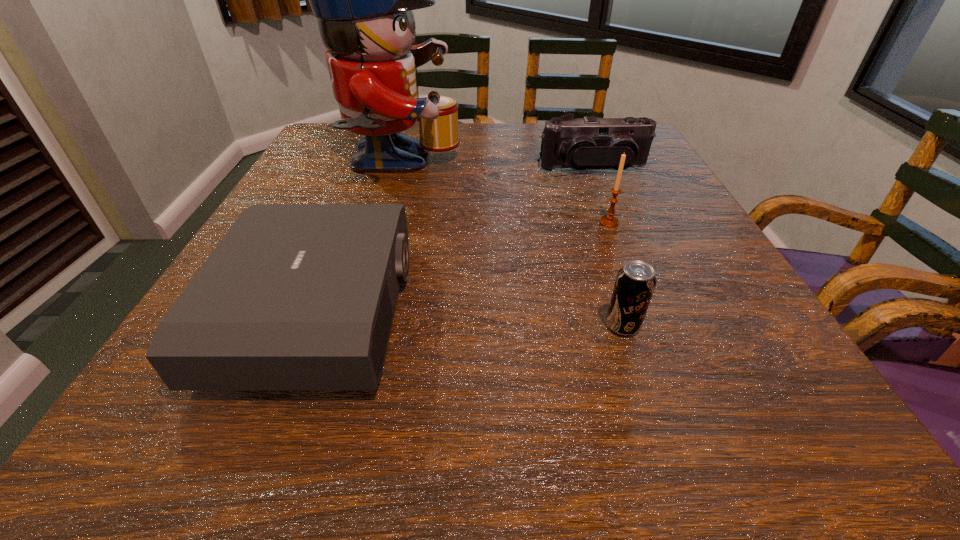
Where is `blank area in the image that satisfies the following two spatial constraints: 1. on the front-facing side of the second tallest object; 2. on the left side of the nutcracker`? blank area in the image that satisfies the following two spatial constraints: 1. on the front-facing side of the second tallest object; 2. on the left side of the nutcracker is located at coordinates (381, 222).